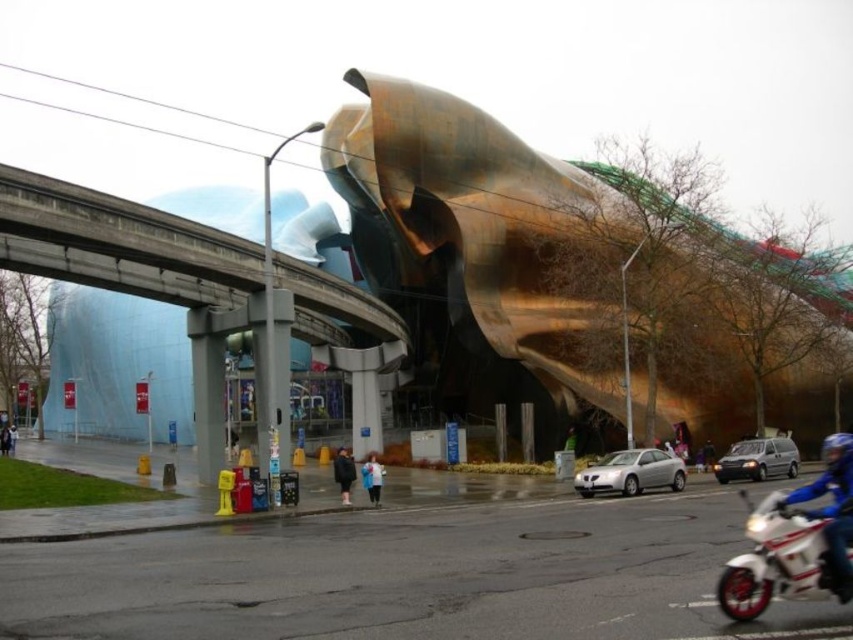
Question: Is white matte jacket at center wider than blue fabric jacket at lower right?

Choices:
 (A) no
 (B) yes

Answer: (B)

Question: Which of the following is the farthest from the observer?

Choices:
 (A) blue leather jacket at lower right
 (B) white matte motorbike at lower right

Answer: (A)

Question: Based on their relative distances, which object is nearer to the black matte jacket at center?

Choices:
 (A) blue fabric jacket at center
 (B) blue leather jacket at lower right

Answer: (A)

Question: Is blue leather jacket at lower right positioned before silver metallic car at center?

Choices:
 (A) yes
 (B) no

Answer: (A)

Question: Is the position of silver metallic car at center less distant than that of blue fabric jacket at lower right?

Choices:
 (A) yes
 (B) no

Answer: (A)

Question: Among these objects, which one is farthest from the camera?

Choices:
 (A) blue fabric jacket at lower right
 (B) concrete bridge at center
 (C) silver metallic van at center-right
 (D) black matte jacket at center

Answer: (A)